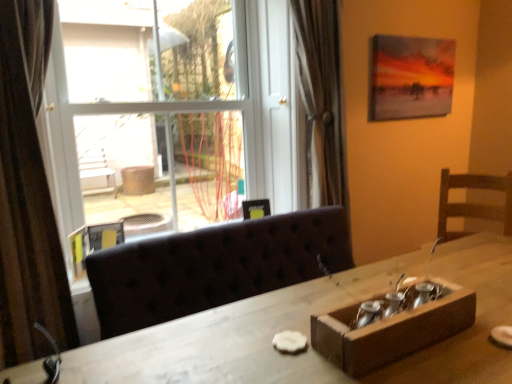
Where is `blank space above matte canvas painting at upper right, the 2th picture frame ordered from the bottom (from a real-world perspective)`? The height and width of the screenshot is (384, 512). blank space above matte canvas painting at upper right, the 2th picture frame ordered from the bottom (from a real-world perspective) is located at coordinates (419, 38).